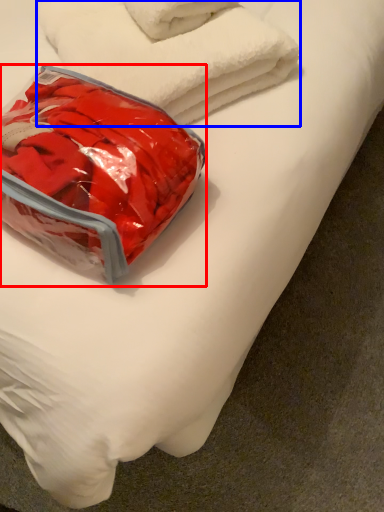
Question: Among these objects, which one is farthest to the camera, pack (highlighted by a red box) or towel (highlighted by a blue box)?

Choices:
 (A) pack
 (B) towel

Answer: (B)